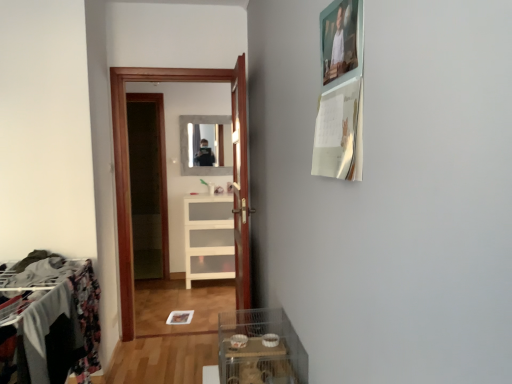
Question: Can you confirm if matte glass mirror at center is taller than white glossy cabinet at center?

Choices:
 (A) no
 (B) yes

Answer: (A)

Question: From a real-world perspective, is matte glass mirror at center beneath white glossy cabinet at center?

Choices:
 (A) yes
 (B) no

Answer: (B)

Question: Is matte glass mirror at center aimed at white glossy cabinet at center?

Choices:
 (A) yes
 (B) no

Answer: (B)

Question: Could white glossy cabinet at center be considered to be inside matte glass mirror at center?

Choices:
 (A) no
 (B) yes

Answer: (A)

Question: Considering the relative sizes of matte glass mirror at center and white glossy cabinet at center in the image provided, is matte glass mirror at center wider than white glossy cabinet at center?

Choices:
 (A) no
 (B) yes

Answer: (A)

Question: Considering the relative positions of matte glass mirror at center and white glossy cabinet at center in the image provided, is matte glass mirror at center in front of white glossy cabinet at center?

Choices:
 (A) yes
 (B) no

Answer: (B)

Question: Is metallic wire rack at left positioned in front of transparent plastic container at lower center?

Choices:
 (A) no
 (B) yes

Answer: (A)

Question: From a real-world perspective, is metallic wire rack at left physically below transparent plastic container at lower center?

Choices:
 (A) yes
 (B) no

Answer: (A)

Question: Is metallic wire rack at left thinner than transparent plastic container at lower center?

Choices:
 (A) yes
 (B) no

Answer: (A)

Question: Can you confirm if metallic wire rack at left is taller than transparent plastic container at lower center?

Choices:
 (A) no
 (B) yes

Answer: (B)

Question: Is metallic wire rack at left next to transparent plastic container at lower center and touching it?

Choices:
 (A) no
 (B) yes

Answer: (A)

Question: From a real-world perspective, is metallic wire rack at left over transparent plastic container at lower center?

Choices:
 (A) no
 (B) yes

Answer: (A)

Question: Is wooden door at center in contact with white glossy cabinet at center?

Choices:
 (A) no
 (B) yes

Answer: (A)